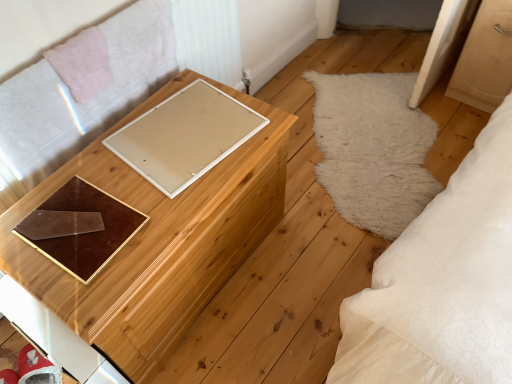
Locate an element on the screen. This screenshot has height=384, width=512. free location above brown glossy tray at center (from a real-world perspective) is located at coordinates (72, 223).